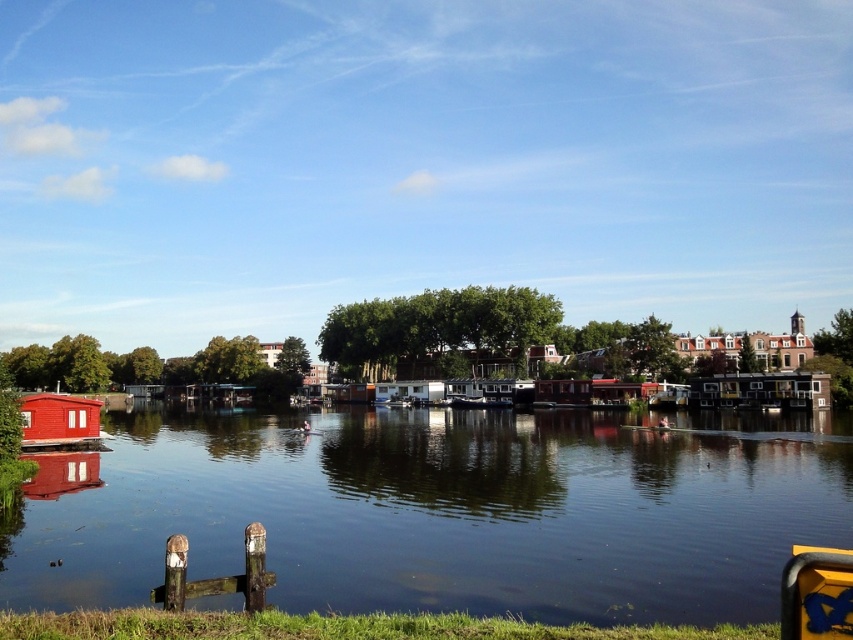
Question: Which point is farther from the camera taking this photo?

Choices:
 (A) (538, 449)
 (B) (67, 406)

Answer: (A)

Question: Does smooth water at center appear under matte wooden hut at left?

Choices:
 (A) yes
 (B) no

Answer: (A)

Question: Observing the image, what is the correct spatial positioning of smooth water at center in reference to matte wooden hut at left?

Choices:
 (A) right
 (B) left

Answer: (A)

Question: Which point is farther from the camera taking this photo?

Choices:
 (A) (288, 522)
 (B) (50, 428)

Answer: (B)

Question: Which of the following is the farthest from the observer?

Choices:
 (A) (25, 429)
 (B) (608, 464)

Answer: (A)

Question: Can you confirm if smooth water at center is smaller than matte wooden hut at left?

Choices:
 (A) yes
 (B) no

Answer: (B)